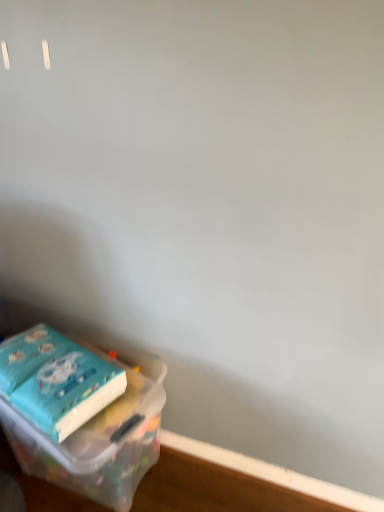
Question: Are translucent plastic container at lower left and teal matte paper at lower left far apart?

Choices:
 (A) yes
 (B) no

Answer: (B)

Question: Is translucent plastic container at lower left in front of teal matte paper at lower left?

Choices:
 (A) no
 (B) yes

Answer: (B)

Question: Is translucent plastic container at lower left positioned behind teal matte paper at lower left?

Choices:
 (A) yes
 (B) no

Answer: (B)

Question: Is translucent plastic container at lower left bigger than teal matte paper at lower left?

Choices:
 (A) no
 (B) yes

Answer: (B)

Question: Does translucent plastic container at lower left have a lesser width compared to teal matte paper at lower left?

Choices:
 (A) no
 (B) yes

Answer: (A)

Question: Is teal matte paper at lower left a part of translucent plastic container at lower left?

Choices:
 (A) yes
 (B) no

Answer: (B)

Question: From a real-world perspective, is translucent plastic container at lower left physically below wooden at lower left?

Choices:
 (A) no
 (B) yes

Answer: (A)

Question: Does translucent plastic container at lower left appear on the right side of wooden at lower left?

Choices:
 (A) no
 (B) yes

Answer: (A)

Question: From the image's perspective, is translucent plastic container at lower left over wooden at lower left?

Choices:
 (A) no
 (B) yes

Answer: (B)

Question: Is translucent plastic container at lower left far from wooden at lower left?

Choices:
 (A) yes
 (B) no

Answer: (B)

Question: Is translucent plastic container at lower left shorter than wooden at lower left?

Choices:
 (A) yes
 (B) no

Answer: (B)

Question: Is wooden at lower left completely or partially inside translucent plastic container at lower left?

Choices:
 (A) yes
 (B) no

Answer: (B)

Question: Is wooden at lower left at the right side of teal matte paper at lower left?

Choices:
 (A) yes
 (B) no

Answer: (A)